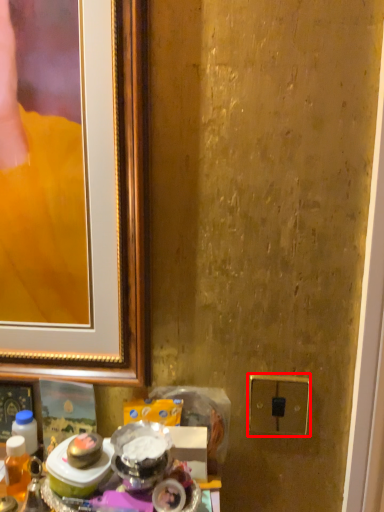
Question: In this image, where is electric outlet (annotated by the red box) located relative to beverage?

Choices:
 (A) left
 (B) right

Answer: (B)